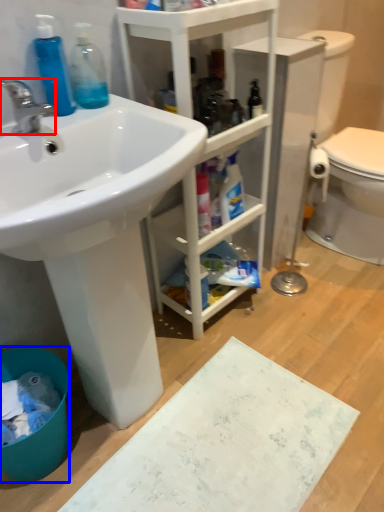
Question: Which of the following is the closest to the observer, tap (highlighted by a red box) or toilet bowl (highlighted by a blue box)?

Choices:
 (A) tap
 (B) toilet bowl

Answer: (A)